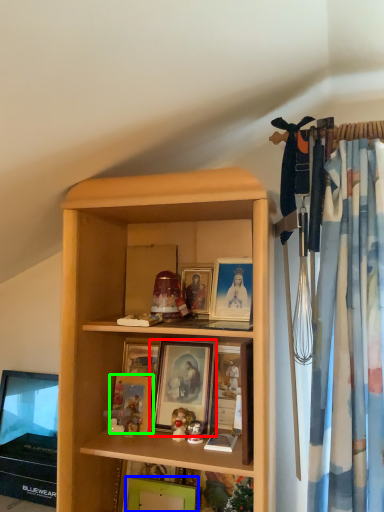
Question: Considering the real-world distances, which object is closest to picture frame (highlighted by a red box)? picture frame (highlighted by a blue box) or picture frame (highlighted by a green box).

Choices:
 (A) picture frame
 (B) picture frame

Answer: (B)